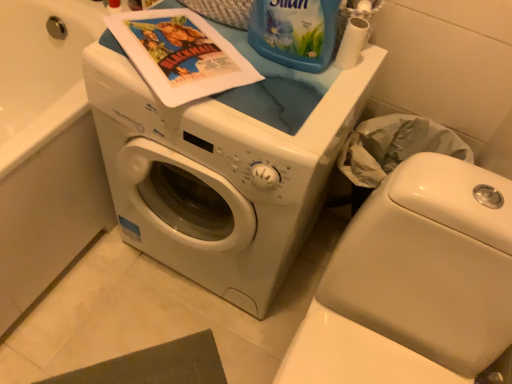
The height and width of the screenshot is (384, 512). I want to click on vacant region above matte paper comic book at upper center (from a real-world perspective), so click(181, 41).